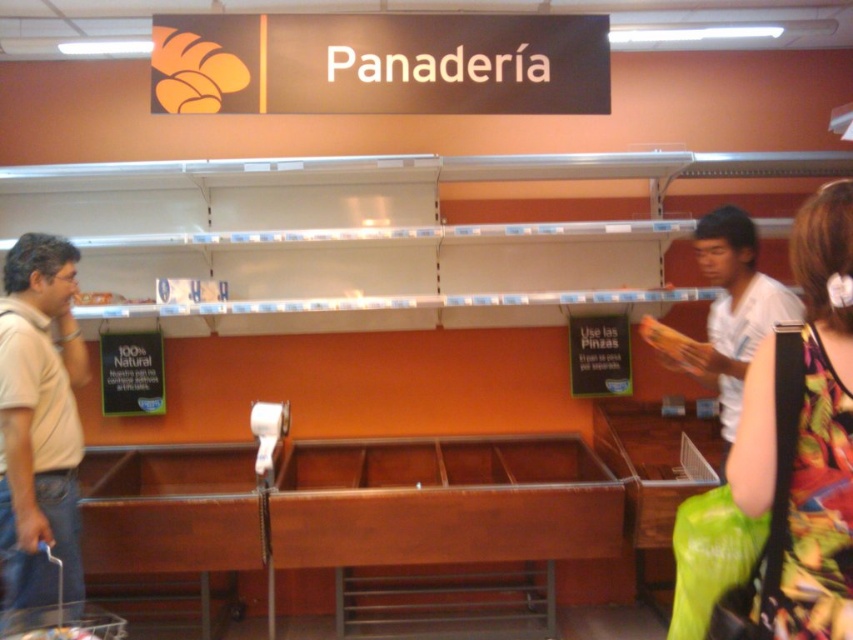
Question: Estimate the real-world distances between objects in this image. Which object is closer to the beige cotton shirt at left?

Choices:
 (A) white cotton shirt at right
 (B) floral fabric dress at lower right

Answer: (B)

Question: Which of the following is the farthest from the observer?

Choices:
 (A) (706, 250)
 (B) (67, 374)
 (C) (833, 320)

Answer: (B)

Question: Can you confirm if floral fabric dress at lower right is positioned above beige cotton shirt at left?

Choices:
 (A) yes
 (B) no

Answer: (A)

Question: Which object is closer to the camera taking this photo?

Choices:
 (A) beige cotton shirt at left
 (B) floral fabric dress at lower right
 (C) white cotton shirt at right

Answer: (B)

Question: In this image, where is beige cotton shirt at left located relative to white cotton shirt at right?

Choices:
 (A) above
 (B) below

Answer: (B)

Question: Does floral fabric dress at lower right appear under beige cotton shirt at left?

Choices:
 (A) yes
 (B) no

Answer: (B)